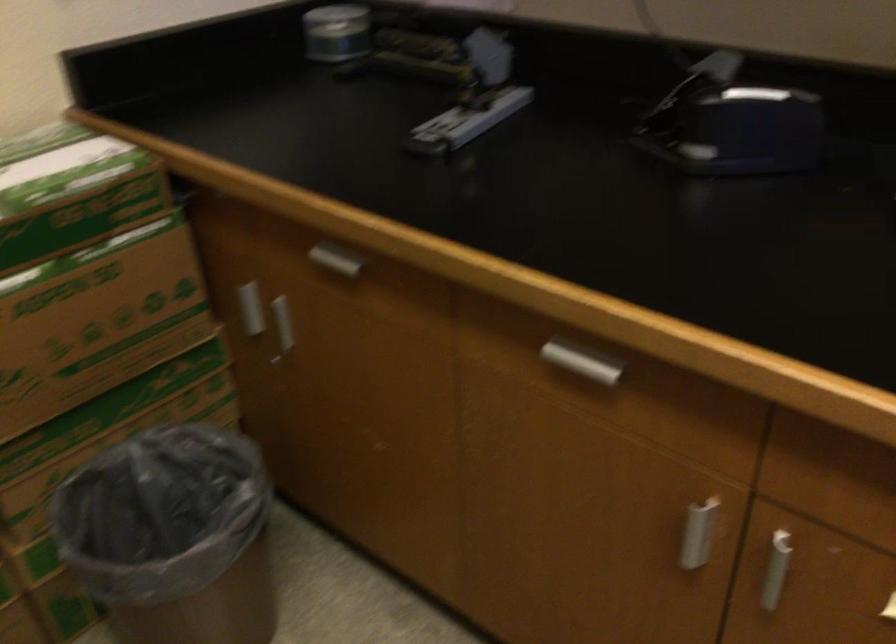
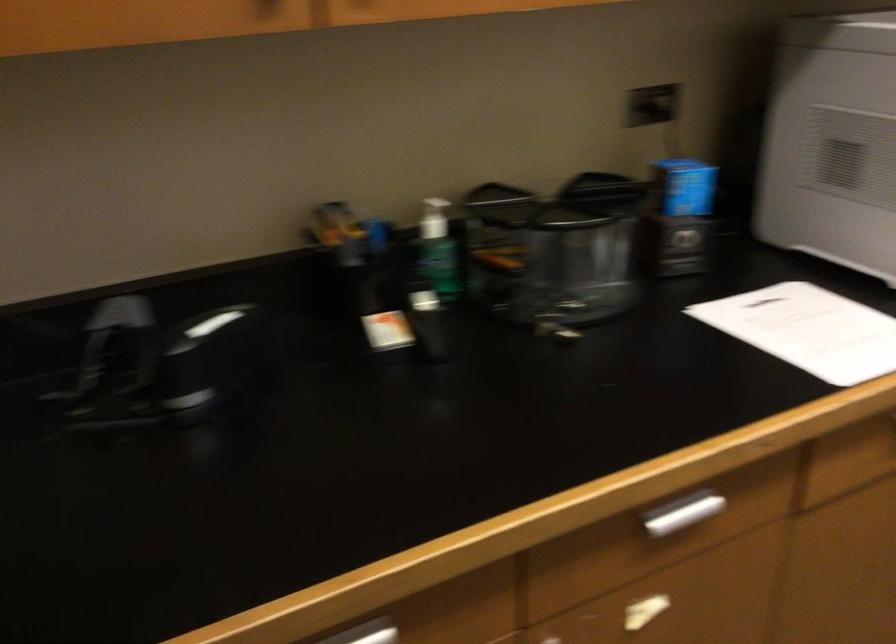
Locate, in the second image, the point that corresponds to (610,365) in the first image.

(369, 630)